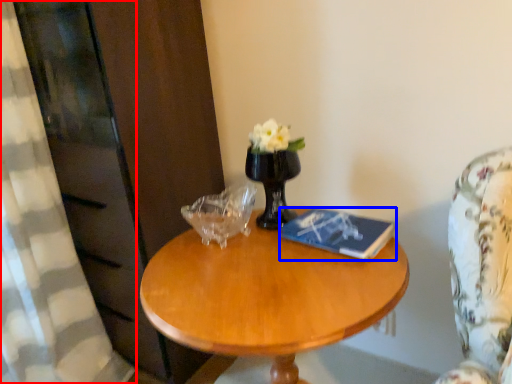
Question: Which point is further to the camera, curtain (highlighted by a red box) or book (highlighted by a blue box)?

Choices:
 (A) curtain
 (B) book

Answer: (B)